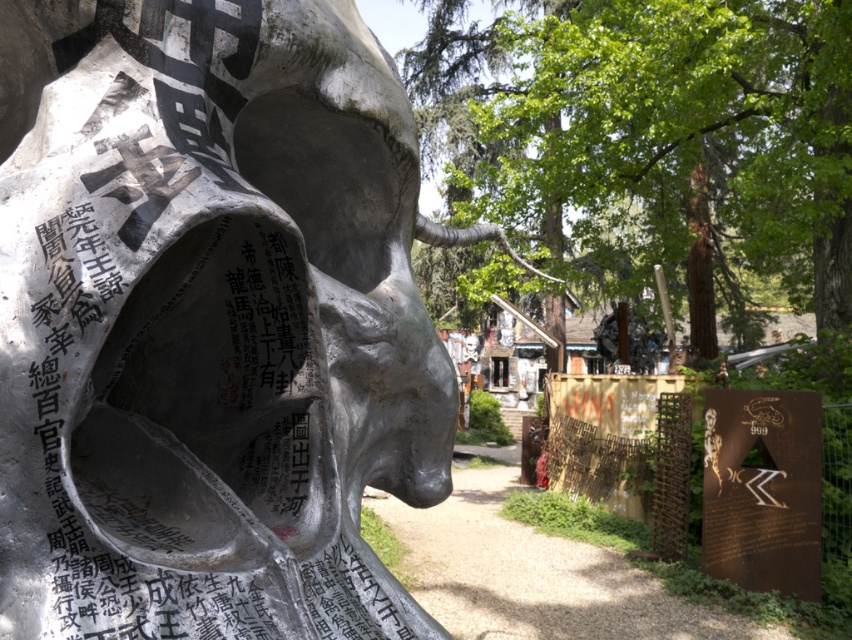
Question: Can you confirm if polished silver skull at center is thinner than green leafy tree at center?

Choices:
 (A) yes
 (B) no

Answer: (A)

Question: From the image, what is the correct spatial relationship of polished silver skull at center in relation to green leafy tree at center?

Choices:
 (A) right
 (B) left

Answer: (B)

Question: Which point is closer to the camera?

Choices:
 (A) (15, 157)
 (B) (848, 192)

Answer: (A)

Question: Does polished silver skull at center appear on the right side of green leafy tree at center?

Choices:
 (A) yes
 (B) no

Answer: (B)

Question: Which object appears farthest from the camera in this image?

Choices:
 (A) polished silver skull at center
 (B) green leafy tree at center

Answer: (B)